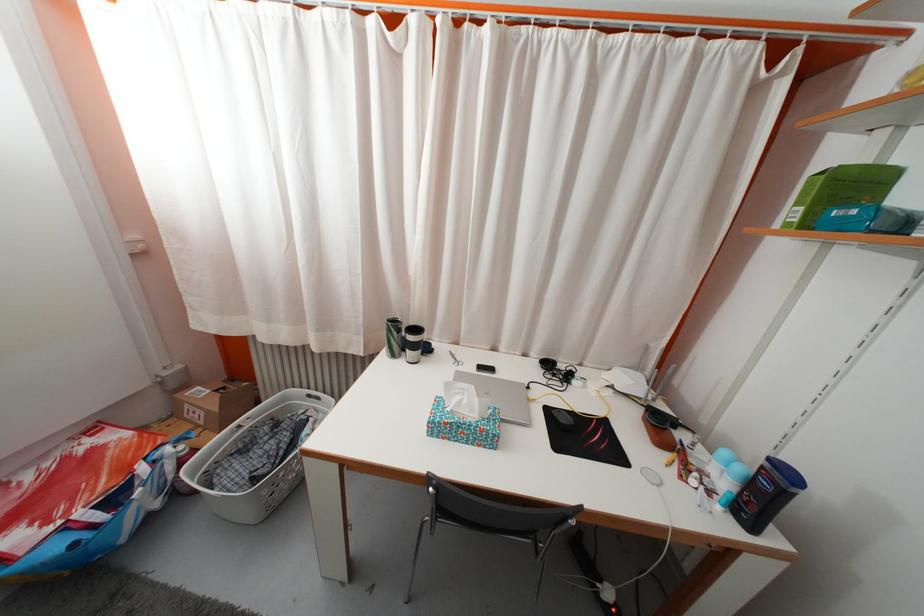
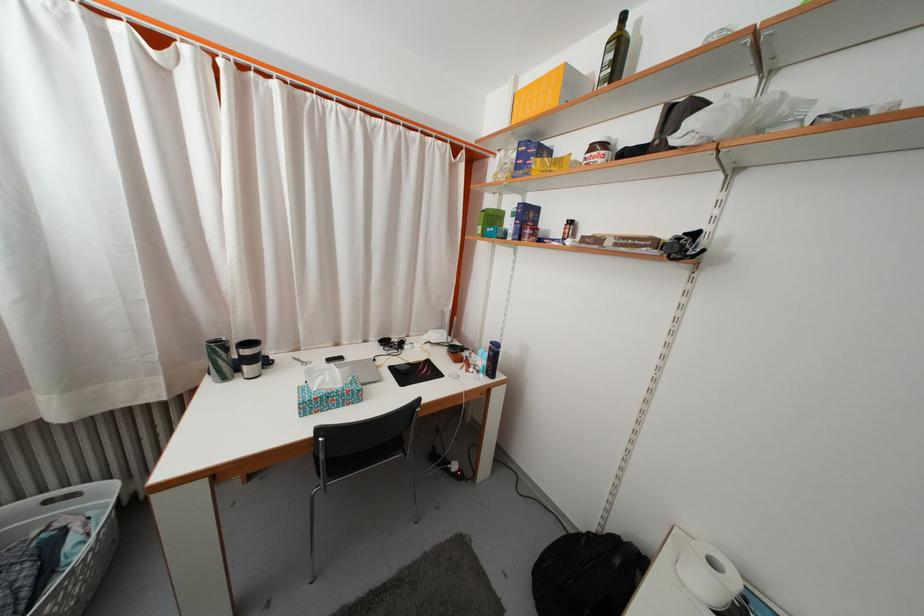
The point at [417,344] is marked in the first image. Where is the corresponding point in the second image?

(251, 359)